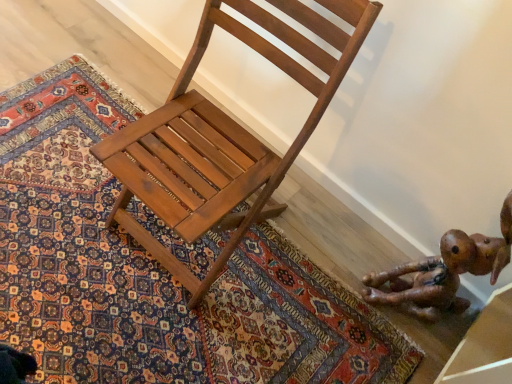
Locate an element on the screen. The height and width of the screenshot is (384, 512). free region under brown leather toy at lower right (from a real-world perspective) is located at coordinates (399, 312).